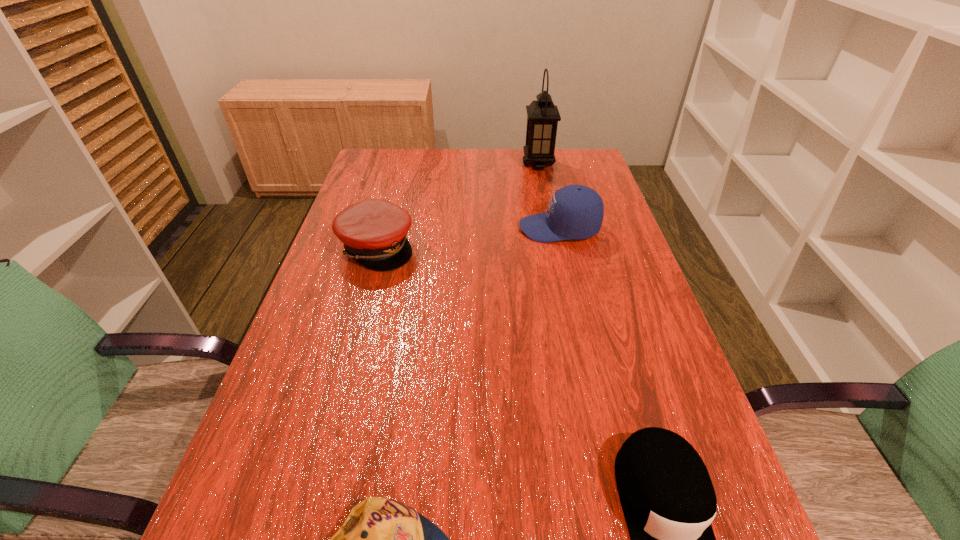
Locate an element on the screen. The width and height of the screenshot is (960, 540). cap located at the right edge is located at coordinates (576, 212).

The height and width of the screenshot is (540, 960). I want to click on object that is at the far right corner, so click(542, 115).

Locate an element on the screen. Image resolution: width=960 pixels, height=540 pixels. vacant space at the far edge is located at coordinates (519, 156).

Locate an element on the screen. free space at the left edge is located at coordinates (336, 354).

At what (x,y) coordinates should I click in order to perform the action: click on vacant space at the right edge of the desktop. Please return your answer as a coordinate pair (x, y). This screenshot has width=960, height=540. Looking at the image, I should click on (613, 429).

This screenshot has height=540, width=960. In the image, there is a desktop. What are the coordinates of `free space at the far left corner` in the screenshot? It's located at (369, 175).

At what (x,y) coordinates should I click in order to perform the action: click on free space at the far right corner of the desktop. Please return your answer as a coordinate pair (x, y). The width and height of the screenshot is (960, 540). Looking at the image, I should click on (571, 154).

In order to click on free space between the tallest cap and the tallest object in this screenshot , I will do [x=549, y=196].

Locate an element on the screen. The height and width of the screenshot is (540, 960). free space between the farthest object and the second tallest object is located at coordinates (549, 196).

Where is `object that stands as the second closest to the lantern`? This screenshot has width=960, height=540. object that stands as the second closest to the lantern is located at coordinates (373, 231).